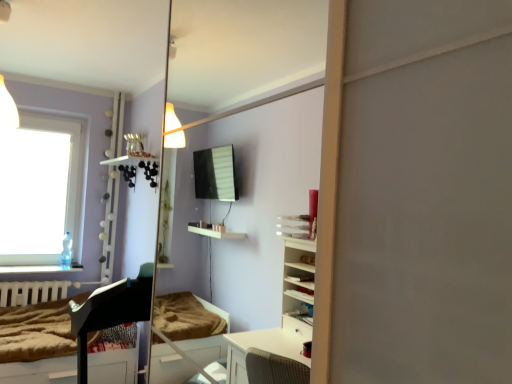
Locate an element on the screen. blank space above white matte radiator at lower left (from a real-world perspective) is located at coordinates (49, 277).